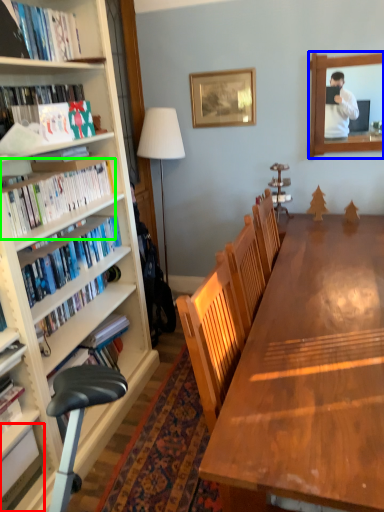
Question: Considering the real-world distances, which object is closest to book (highlighted by a red box)? mirror (highlighted by a blue box) or book (highlighted by a green box).

Choices:
 (A) mirror
 (B) book

Answer: (B)